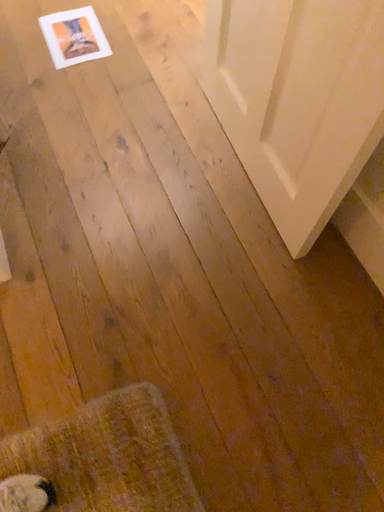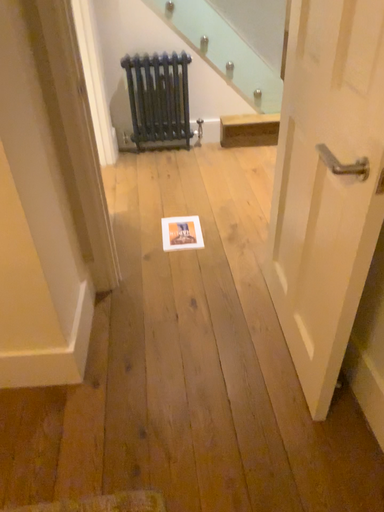
Question: Which way did the camera rotate in the video?

Choices:
 (A) rotated downward
 (B) rotated upward

Answer: (B)